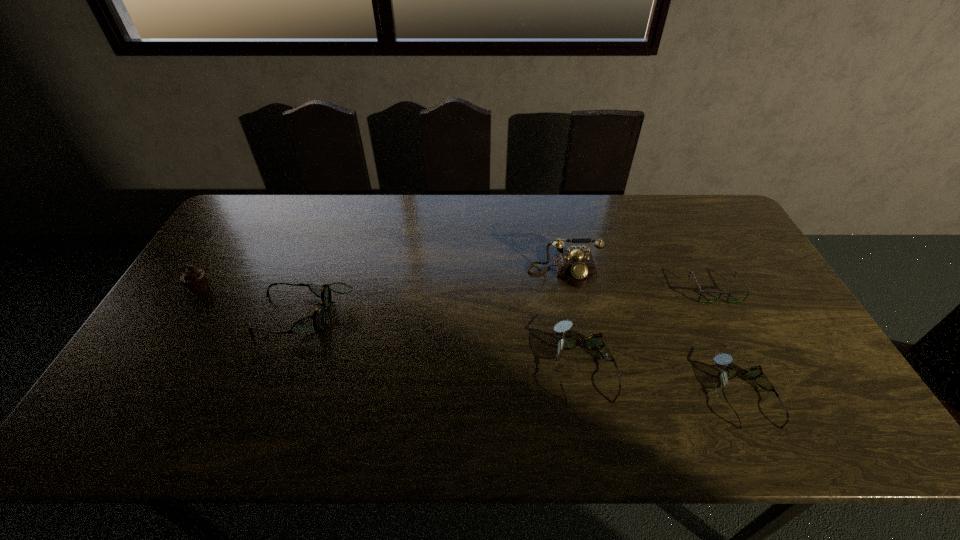
Where is `the leftmost spectacles`? This screenshot has height=540, width=960. the leftmost spectacles is located at coordinates (317, 322).

Find the location of a particular element. the third shortest spectacles is located at coordinates (594, 341).

I want to click on the second spectacles from left to right, so click(594, 341).

The image size is (960, 540). In order to click on the tallest object in this screenshot , I will do `click(575, 267)`.

You are a GUI agent. You are given a task and a screenshot of the screen. Output one action in this format:
    pyautogui.click(x=<x>, y=<y>)
    Task: Click on the second tallest object
    Image resolution: width=960 pixels, height=540 pixels.
    Given the screenshot: What is the action you would take?
    pyautogui.click(x=194, y=279)

Locate an element on the screen. the leftmost object is located at coordinates (194, 279).

This screenshot has width=960, height=540. I want to click on free space located on the front-facing side of the leftmost spectacles, so click(x=184, y=315).

Locate an element on the screen. The width and height of the screenshot is (960, 540). vacant region located 0.120m on the front-facing side of the leftmost spectacles is located at coordinates (216, 315).

Identify the location of free space located 0.230m on the front-facing side of the leftmost spectacles. The height and width of the screenshot is (540, 960). (177, 315).

Find the location of a particular element. free location located on the dial of the tallest object is located at coordinates (588, 396).